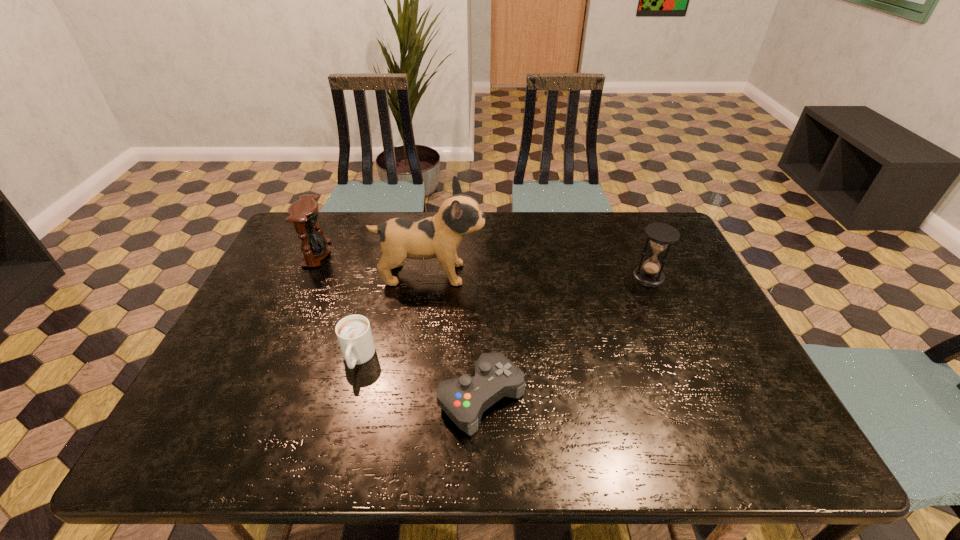
What are the coordinates of `object that is at the far edge` in the screenshot? It's located at (304, 213).

The height and width of the screenshot is (540, 960). Find the location of `object present at the near edge`. object present at the near edge is located at coordinates (464, 399).

Where is `object that is at the left edge`? Image resolution: width=960 pixels, height=540 pixels. object that is at the left edge is located at coordinates (304, 213).

Identify the location of object located at the right edge. (661, 235).

Locate an element on the screen. This screenshot has width=960, height=540. object present at the far left corner is located at coordinates (304, 213).

Locate an element on the screen. vacant space at the far edge of the desktop is located at coordinates (583, 221).

In order to click on vacant space at the near edge of the desktop in this screenshot , I will do `click(580, 436)`.

In the image, there is a desktop. Where is `vacant space at the left edge`? vacant space at the left edge is located at coordinates (274, 313).

Find the location of `vacant space at the right edge of the desktop`. vacant space at the right edge of the desktop is located at coordinates (723, 356).

Find the location of `free space at the far left corner`. free space at the far left corner is located at coordinates (336, 218).